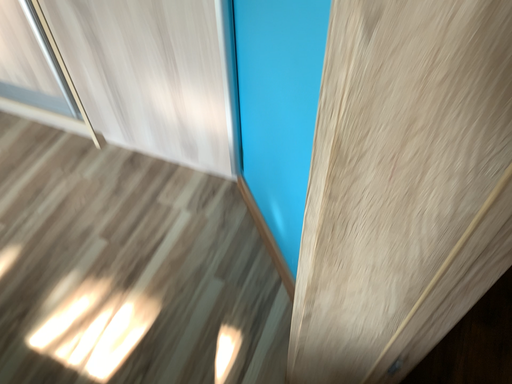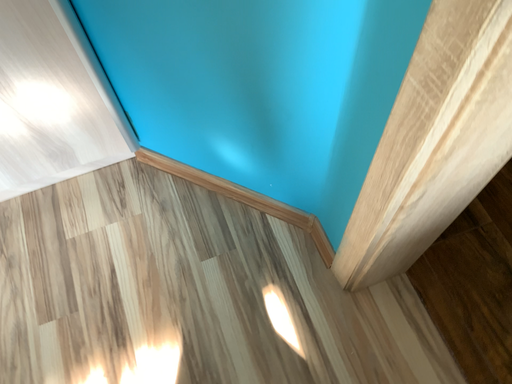
Question: How did the camera likely rotate when shooting the video?

Choices:
 (A) rotated left
 (B) rotated right

Answer: (B)